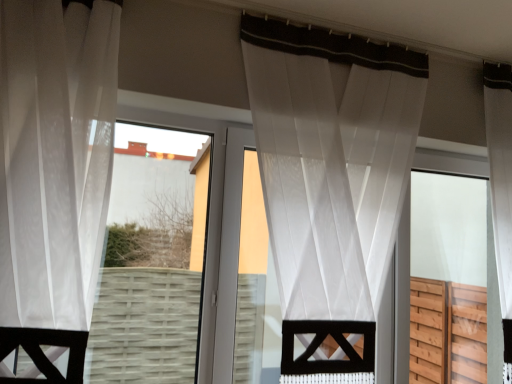
Question: Is transparent fabric at center inside white sheer curtain at left, the first curtain when ordered from left to right?

Choices:
 (A) yes
 (B) no

Answer: (B)

Question: From a real-world perspective, is white sheer curtain at left, placed as the 2th curtain when sorted from back to front, physically below transparent fabric at center?

Choices:
 (A) yes
 (B) no

Answer: (B)

Question: Considering the relative sizes of white sheer curtain at left, marked as the 2th curtain in a right-to-left arrangement, and transparent fabric at center in the image provided, is white sheer curtain at left, marked as the 2th curtain in a right-to-left arrangement, shorter than transparent fabric at center?

Choices:
 (A) yes
 (B) no

Answer: (B)

Question: Is white sheer curtain at left, marked as the 2th curtain in a right-to-left arrangement, further to camera compared to transparent fabric at center?

Choices:
 (A) no
 (B) yes

Answer: (A)

Question: Considering the relative sizes of white sheer curtain at left, marked as the 2th curtain in a right-to-left arrangement, and transparent fabric at center in the image provided, is white sheer curtain at left, marked as the 2th curtain in a right-to-left arrangement, thinner than transparent fabric at center?

Choices:
 (A) yes
 (B) no

Answer: (B)

Question: From a real-world perspective, relative to transparent fabric at center, is sheer white curtain at center, the 2th curtain in the left-to-right sequence, vertically above or below?

Choices:
 (A) above
 (B) below

Answer: (A)

Question: Is point (380, 71) closer or farther from the camera than point (154, 162)?

Choices:
 (A) closer
 (B) farther

Answer: (A)

Question: Is sheer white curtain at center, positioned as the 1th curtain in right-to-left order, inside or outside of transparent fabric at center?

Choices:
 (A) inside
 (B) outside

Answer: (B)

Question: Considering the relative positions of sheer white curtain at center, positioned as the 1th curtain in right-to-left order, and transparent fabric at center in the image provided, is sheer white curtain at center, positioned as the 1th curtain in right-to-left order, to the left or to the right of transparent fabric at center?

Choices:
 (A) right
 (B) left

Answer: (A)

Question: In terms of size, does transparent wood screen door at right appear bigger or smaller than transparent fabric at center?

Choices:
 (A) small
 (B) big

Answer: (B)

Question: Is point (432, 362) closer or farther from the camera than point (144, 142)?

Choices:
 (A) farther
 (B) closer

Answer: (A)

Question: Would you say transparent wood screen door at right is to the left or to the right of transparent fabric at center in the picture?

Choices:
 (A) right
 (B) left

Answer: (A)

Question: Relative to transparent fabric at center, is transparent wood screen door at right in front or behind?

Choices:
 (A) front
 (B) behind

Answer: (B)

Question: Choose the correct answer: Is transparent wood screen door at right inside white sheer curtain at left, placed as the 2th curtain when sorted from back to front, or outside it?

Choices:
 (A) outside
 (B) inside

Answer: (A)

Question: Relative to white sheer curtain at left, marked as the 2th curtain in a right-to-left arrangement, is transparent wood screen door at right in front or behind?

Choices:
 (A) behind
 (B) front

Answer: (A)